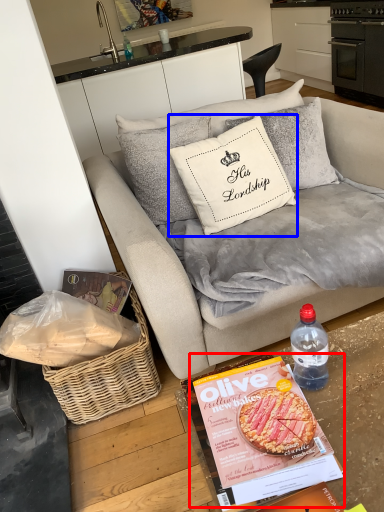
Question: Which object appears farthest to the camera in this image, magazine (highlighted by a red box) or pillow (highlighted by a blue box)?

Choices:
 (A) magazine
 (B) pillow

Answer: (B)